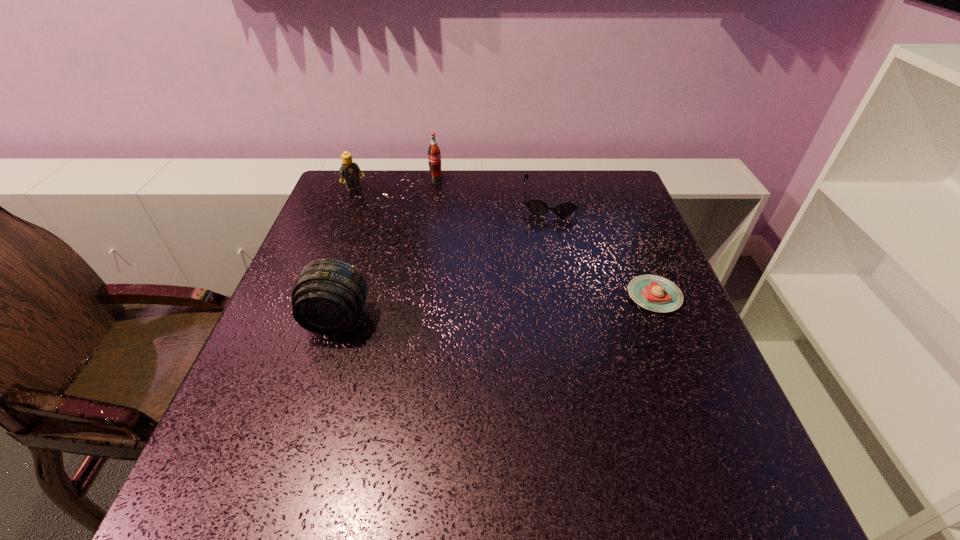
What are the coordinates of `sunglasses that is at the far edge` in the screenshot? It's located at (563, 209).

Identify the location of soda bottle at the far edge. The image size is (960, 540). (434, 155).

At what (x,y) coordinates should I click in order to perform the action: click on telephoto lens located in the left edge section of the desktop. Please return your answer as a coordinate pair (x, y). The image size is (960, 540). Looking at the image, I should click on (328, 296).

You are a GUI agent. You are given a task and a screenshot of the screen. Output one action in this format:
    pyautogui.click(x=<x>, y=<y>)
    Task: Click on the Lego positioned at the left edge
    The image size is (960, 540).
    Given the screenshot: What is the action you would take?
    pyautogui.click(x=349, y=170)

This screenshot has height=540, width=960. In order to click on pastry located in the right edge section of the desktop in this screenshot , I will do `click(655, 293)`.

Locate an element on the screen. The height and width of the screenshot is (540, 960). sunglasses that is at the right edge is located at coordinates (563, 209).

The width and height of the screenshot is (960, 540). I want to click on object at the far left corner, so click(x=349, y=170).

You are a GUI agent. You are given a task and a screenshot of the screen. Output one action in this format:
    pyautogui.click(x=<x>, y=<y>)
    Task: Click on the object that is at the far right corner
    
    Given the screenshot: What is the action you would take?
    click(563, 209)

Locate an element on the screen. vacant space at the far edge of the desktop is located at coordinates (485, 180).

What are the coordinates of `free region at the near edge of the desktop` in the screenshot? It's located at (583, 415).